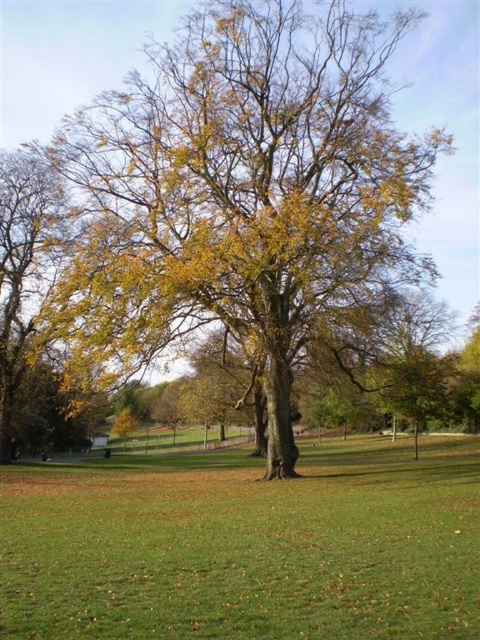
Who is more forward, (405, 168) or (312, 634)?

Point (312, 634) is more forward.

Measure the distance between yellow-green leafy oak tree at center and green grassy field at center.

yellow-green leafy oak tree at center is 31.72 feet from green grassy field at center.

Which is behind, point (223, 42) or point (180, 477)?

Point (180, 477)

Where is `yellow-green leafy oak tree at center`? yellow-green leafy oak tree at center is located at coordinates (247, 186).